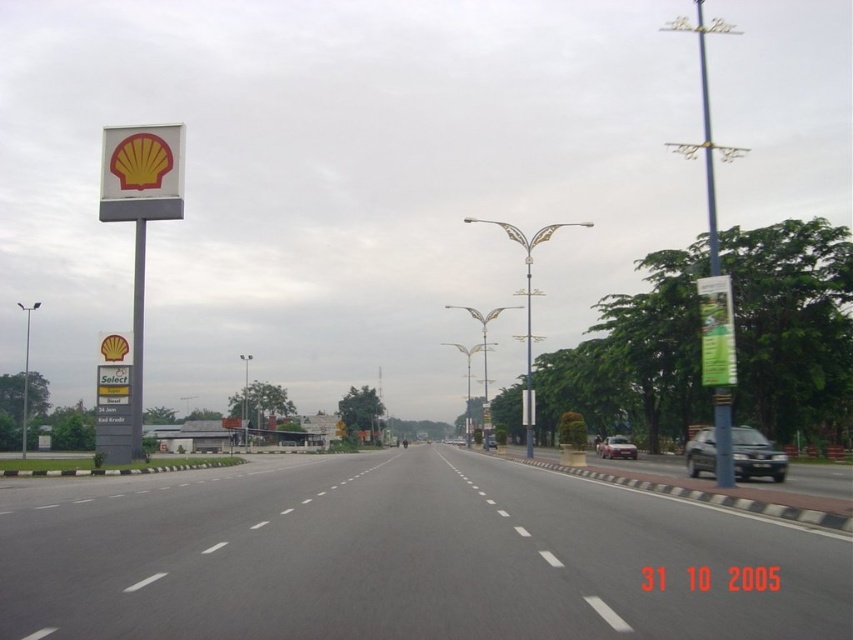
Question: Which is farther from the satin silver suv at center?

Choices:
 (A) metallic silver car at center
 (B) metallic pole at center
 (C) blue metallic pole at upper right
 (D) metallic gray signpost at left

Answer: (C)

Question: Can you confirm if metallic gray signpost at left is positioned above metallic pole at center?

Choices:
 (A) yes
 (B) no

Answer: (B)

Question: Is blue metallic pole at upper right to the right of satin silver suv at center from the viewer's perspective?

Choices:
 (A) no
 (B) yes

Answer: (B)

Question: Which point appears closest to the camera in this image?

Choices:
 (A) (723, 452)
 (B) (839, 596)

Answer: (B)

Question: Which is nearer to the black asphalt highway at center?

Choices:
 (A) satin silver suv at center
 (B) metallic silver car at center

Answer: (A)

Question: Is blue metallic pole at upper right below metallic gray signpost at left?

Choices:
 (A) no
 (B) yes

Answer: (A)